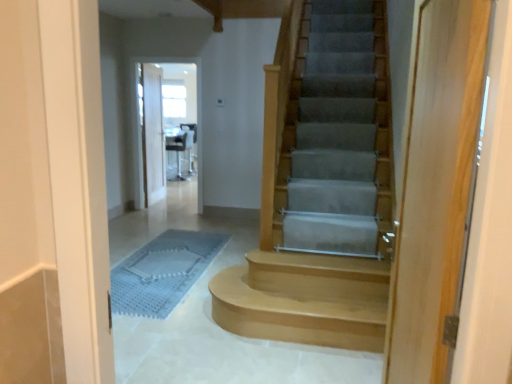
Question: Can you confirm if white wood door at upper center, the 2th door in the right-to-left sequence, is taller than clear glass screen door at center?

Choices:
 (A) yes
 (B) no

Answer: (B)

Question: Considering the relative sizes of white wood door at upper center, the 1th door positioned from the back, and clear glass screen door at center in the image provided, is white wood door at upper center, the 1th door positioned from the back, wider than clear glass screen door at center?

Choices:
 (A) no
 (B) yes

Answer: (A)

Question: Is white wood door at upper center, the 2th door in the right-to-left sequence, shorter than clear glass screen door at center?

Choices:
 (A) yes
 (B) no

Answer: (A)

Question: Are white wood door at upper center, the first door positioned from the left, and clear glass screen door at center far apart?

Choices:
 (A) yes
 (B) no

Answer: (B)

Question: Considering the relative sizes of white wood door at upper center, the 1th door positioned from the back, and clear glass screen door at center in the image provided, is white wood door at upper center, the 1th door positioned from the back, smaller than clear glass screen door at center?

Choices:
 (A) no
 (B) yes

Answer: (B)

Question: Looking at their shapes, would you say clear glass screen door at center is wider or thinner than white wood door at upper center, the first door positioned from the left?

Choices:
 (A) thin
 (B) wide

Answer: (B)

Question: In terms of height, does clear glass screen door at center look taller or shorter compared to white wood door at upper center, which is the second door in front-to-back order?

Choices:
 (A) tall
 (B) short

Answer: (A)

Question: From a real-world perspective, relative to white wood door at upper center, the 1th door positioned from the back, is clear glass screen door at center vertically above or below?

Choices:
 (A) below
 (B) above

Answer: (B)

Question: Considering the positions of clear glass screen door at center and white wood door at upper center, the 1th door positioned from the back, in the image, is clear glass screen door at center bigger or smaller than white wood door at upper center, the 1th door positioned from the back,?

Choices:
 (A) big
 (B) small

Answer: (A)

Question: Would you say blue textured bath mat at lower center is inside or outside light wood door at right, which appears as the second door when viewed from the back?

Choices:
 (A) inside
 (B) outside

Answer: (B)

Question: Is blue textured bath mat at lower center in front of or behind light wood door at right, the 2th door when ordered from left to right, in the image?

Choices:
 (A) front
 (B) behind

Answer: (B)

Question: From the image's perspective, relative to light wood door at right, placed as the first door when sorted from right to left, is blue textured bath mat at lower center above or below?

Choices:
 (A) above
 (B) below

Answer: (B)

Question: From their relative heights in the image, would you say blue textured bath mat at lower center is taller or shorter than light wood door at right, which is the first door in front-to-back order?

Choices:
 (A) short
 (B) tall

Answer: (A)

Question: Which is correct: light brown wood stairs at center is inside smooth concrete stairs at center, or outside of it?

Choices:
 (A) inside
 (B) outside

Answer: (B)

Question: From a real-world perspective, is light brown wood stairs at center above or below smooth concrete stairs at center?

Choices:
 (A) above
 (B) below

Answer: (A)